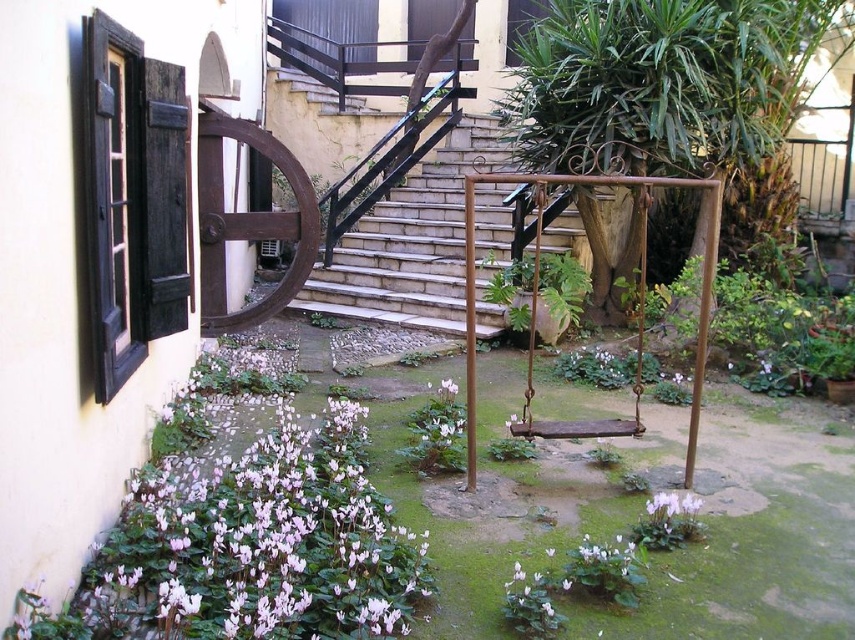
Question: Can you confirm if rustic metal stairs at center is bigger than green leafy plant at center?

Choices:
 (A) yes
 (B) no

Answer: (A)

Question: Which object is closer to the camera taking this photo?

Choices:
 (A) rustic metal stairs at center
 (B) pink matte cyclamen at lower center
 (C) green leafy plant at center

Answer: (B)

Question: Does rustic metal stairs at center come in front of pink matte cyclamen at lower center?

Choices:
 (A) yes
 (B) no

Answer: (B)

Question: Estimate the real-world distances between objects in this image. Which object is closer to the pink matte cyclamen at lower center?

Choices:
 (A) rustic metal stairs at center
 (B) green leafy plant at center
 (C) rusty wood swing at center

Answer: (C)

Question: Considering the relative positions of rustic metal stairs at center and pink matte cyclamen at lower center in the image provided, where is rustic metal stairs at center located with respect to pink matte cyclamen at lower center?

Choices:
 (A) below
 (B) above

Answer: (B)

Question: Which object appears farthest from the camera in this image?

Choices:
 (A) green leafy plant at center
 (B) rustic metal stairs at center
 (C) pink matte cyclamen at lower center
 (D) rusty wood swing at center

Answer: (B)